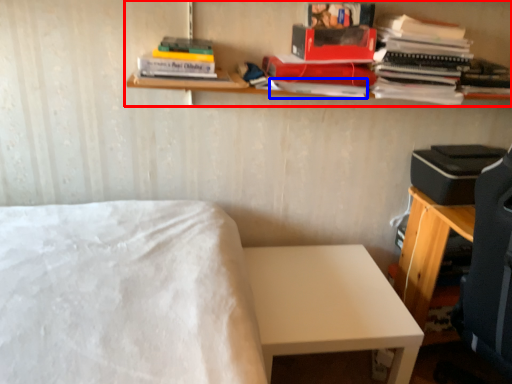
Question: Which point is further to the camera, shelf (highlighted by a red box) or paperback book (highlighted by a blue box)?

Choices:
 (A) shelf
 (B) paperback book

Answer: (B)